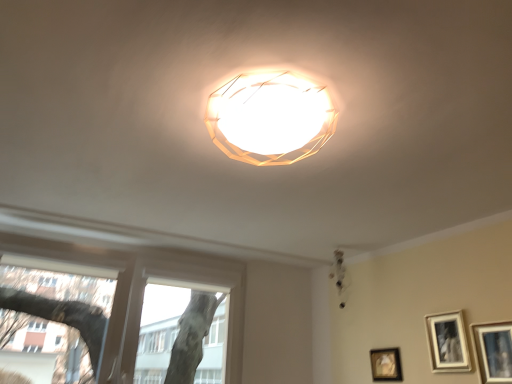
Question: Are matte black picture frame at lower right, the 3th picture frame from the front, and matte white chandelier at upper center far apart?

Choices:
 (A) no
 (B) yes

Answer: (A)

Question: Is matte black picture frame at lower right, positioned as the first picture frame in left-to-right order, not within matte white chandelier at upper center?

Choices:
 (A) yes
 (B) no

Answer: (A)

Question: Is matte black picture frame at lower right, which ranks as the third picture frame in right-to-left order, smaller than matte white chandelier at upper center?

Choices:
 (A) yes
 (B) no

Answer: (A)

Question: Is matte black picture frame at lower right, the 3th picture frame from the front, at the right side of matte white chandelier at upper center?

Choices:
 (A) yes
 (B) no

Answer: (A)

Question: From the image's perspective, is matte black picture frame at lower right, the 3th picture frame from the front, above matte white chandelier at upper center?

Choices:
 (A) yes
 (B) no

Answer: (B)

Question: Considering the relative sizes of matte black picture frame at lower right, the 3th picture frame from the front, and matte white chandelier at upper center in the image provided, is matte black picture frame at lower right, the 3th picture frame from the front, taller than matte white chandelier at upper center?

Choices:
 (A) yes
 (B) no

Answer: (B)

Question: Can we say transparent glass window at lower left lies outside matte black picture frame at lower right, which appears as the 1th picture frame when viewed from the back?

Choices:
 (A) yes
 (B) no

Answer: (A)

Question: From a real-world perspective, is transparent glass window at lower left on top of matte black picture frame at lower right, which ranks as the third picture frame in right-to-left order?

Choices:
 (A) yes
 (B) no

Answer: (A)

Question: From the image's perspective, is transparent glass window at lower left beneath matte black picture frame at lower right, which appears as the 1th picture frame when viewed from the back?

Choices:
 (A) no
 (B) yes

Answer: (A)

Question: From a real-world perspective, is transparent glass window at lower left beneath matte black picture frame at lower right, positioned as the first picture frame in left-to-right order?

Choices:
 (A) no
 (B) yes

Answer: (A)

Question: Considering the relative sizes of transparent glass window at lower left and matte black picture frame at lower right, which ranks as the third picture frame in right-to-left order, in the image provided, is transparent glass window at lower left smaller than matte black picture frame at lower right, which ranks as the third picture frame in right-to-left order,?

Choices:
 (A) no
 (B) yes

Answer: (A)

Question: Is transparent glass window at lower left facing towards matte black picture frame at lower right, the 3th picture frame from the front?

Choices:
 (A) yes
 (B) no

Answer: (B)

Question: Is transparent glass window at lower left positioned with its back to matte black picture frame at lower right, positioned as the 1th picture frame in front-to-back order?

Choices:
 (A) yes
 (B) no

Answer: (B)